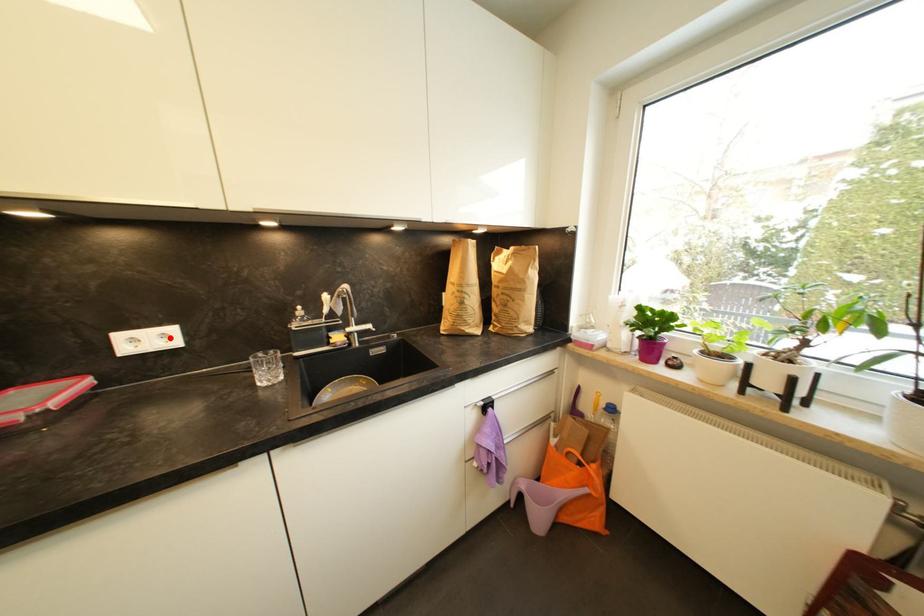
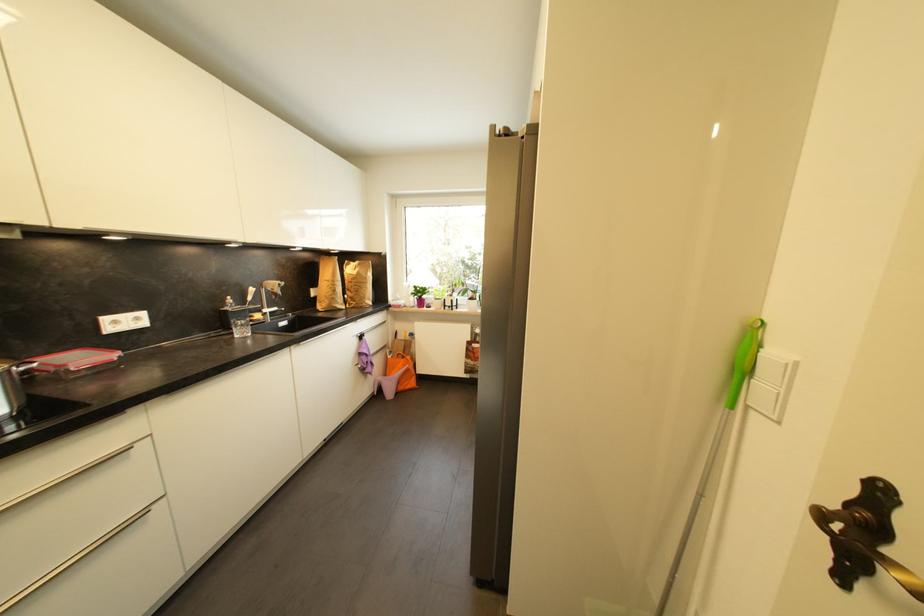
Find the pixel in the second image that matches the highlighted location in the first image.

(142, 321)